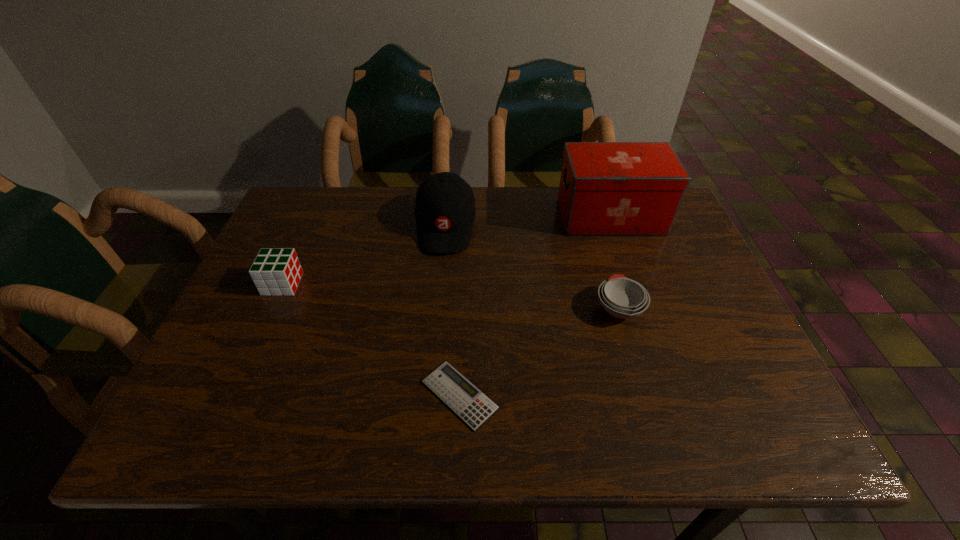
Find the location of a particular element. The image size is (960, 540). free region that satisfies the following two spatial constraints: 1. on the back side of the second shortest object; 2. on the red face of the cube is located at coordinates (612, 284).

Identify the location of free space that satisfies the following two spatial constraints: 1. with a logo on the front of the baseball cap; 2. on the red face of the leftmost object. (441, 284).

The image size is (960, 540). I want to click on free space that satisfies the following two spatial constraints: 1. on the red face of the calculator; 2. on the left side of the cube, so click(233, 395).

At what (x,y) coordinates should I click in order to perform the action: click on vacant space that satisfies the following two spatial constraints: 1. on the back side of the fourth tallest object; 2. on the red face of the third tallest object. Please return your answer as a coordinate pair (x, y). This screenshot has width=960, height=540. Looking at the image, I should click on (612, 284).

Locate an element on the screen. The width and height of the screenshot is (960, 540). free space that satisfies the following two spatial constraints: 1. on the handle side of the tallest object; 2. on the front side of the shortest object is located at coordinates (671, 395).

Locate an element on the screen. Image resolution: width=960 pixels, height=540 pixels. vacant space that satisfies the following two spatial constraints: 1. on the red face of the second shortest object; 2. on the right side of the cube is located at coordinates (272, 308).